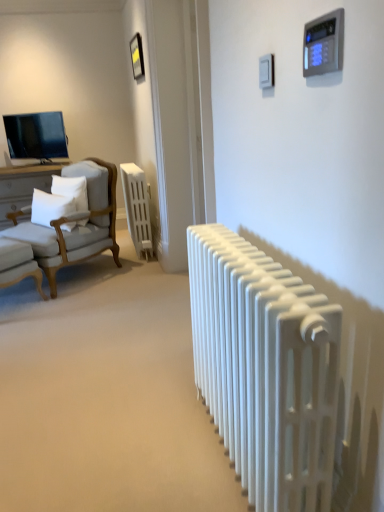
Question: Considering the positions of point (18, 238) and point (21, 251), is point (18, 238) closer or farther from the camera than point (21, 251)?

Choices:
 (A) closer
 (B) farther

Answer: (B)

Question: Is light gray fabric chair at left, positioned as the second chair in bottom-to-top order, to the left or to the right of white fabric chair at left, which is counted as the 2th chair, starting from the top, in the image?

Choices:
 (A) left
 (B) right

Answer: (B)

Question: Considering the real-world distances, which object is closest to the white matte radiator at center, which appears as the first radiator when viewed from the left?

Choices:
 (A) white soft pillow at left, the 1th pillow viewed from the left
 (B) white fabric chair at left, the 1th chair in the bottom-to-top sequence
 (C) matte black tv at upper left
 (D) metallic gold picture frame at upper center
 (E) white matte radiator at center, the 1th radiator when ordered from front to back

Answer: (A)

Question: Estimate the real-world distances between objects in this image. Which object is closer to the white matte radiator at center, acting as the 1th radiator starting from the bottom?

Choices:
 (A) light gray fabric chair at left, marked as the first chair in a top-to-bottom arrangement
 (B) white soft pillow at left, the first pillow viewed from the right
 (C) white fabric chair at left, the 1th chair in the bottom-to-top sequence
 (D) metallic gold picture frame at upper center
 (E) matte black tv at upper left

Answer: (C)